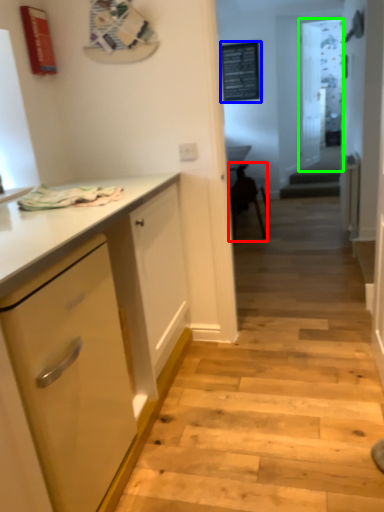
Question: Which is farther away from chair (highlighted by a red box)? bulletin board (highlighted by a blue box) or glass door (highlighted by a green box)?

Choices:
 (A) bulletin board
 (B) glass door

Answer: (B)